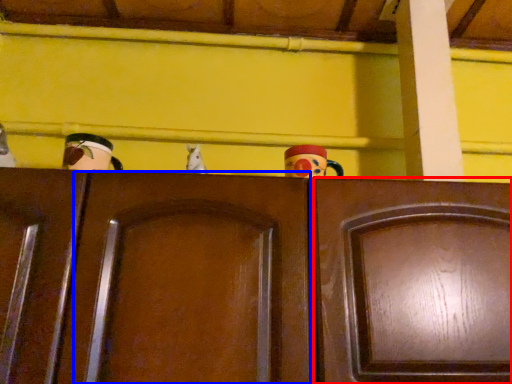
Question: Which point is closer to the camera, door (highlighted by a red box) or door (highlighted by a blue box)?

Choices:
 (A) door
 (B) door

Answer: (B)